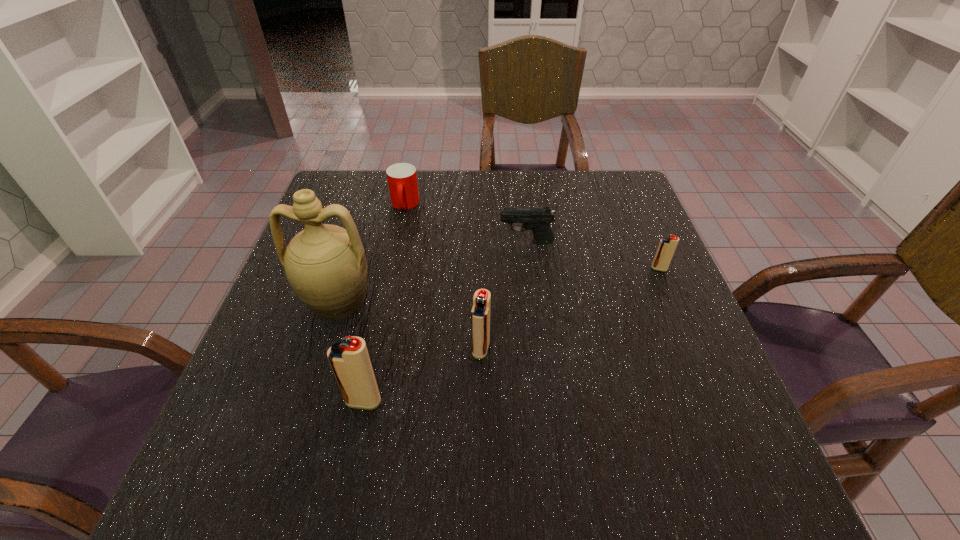
Identify the location of the tallest object. The height and width of the screenshot is (540, 960). (325, 265).

Where is `vacant region located 0.100m on the left of the leftmost igniter`? The height and width of the screenshot is (540, 960). vacant region located 0.100m on the left of the leftmost igniter is located at coordinates (290, 401).

The height and width of the screenshot is (540, 960). Find the location of `vacant space situated on the left of the second farthest igniter`. vacant space situated on the left of the second farthest igniter is located at coordinates (412, 349).

The height and width of the screenshot is (540, 960). What are the coordinates of `vacant space situated on the back of the farthest igniter` in the screenshot? It's located at (633, 207).

Where is `free location located 0.320m on the side of the cup with the handle`? This screenshot has width=960, height=540. free location located 0.320m on the side of the cup with the handle is located at coordinates (384, 304).

Locate an element on the screen. Image resolution: width=960 pixels, height=540 pixels. free location located 0.290m at the barrel of the second farthest object is located at coordinates (385, 242).

The image size is (960, 540). In order to click on vacant region located 0.200m at the barrel of the second farthest object in this screenshot , I will do `click(420, 242)`.

Where is `vacant point located at the barrel of the second farthest object`? vacant point located at the barrel of the second farthest object is located at coordinates coord(396,242).

Where is `free region located on the right of the pitcher`? The width and height of the screenshot is (960, 540). free region located on the right of the pitcher is located at coordinates (552, 300).

Find the location of `object that is at the far edge`. object that is at the far edge is located at coordinates (402, 180).